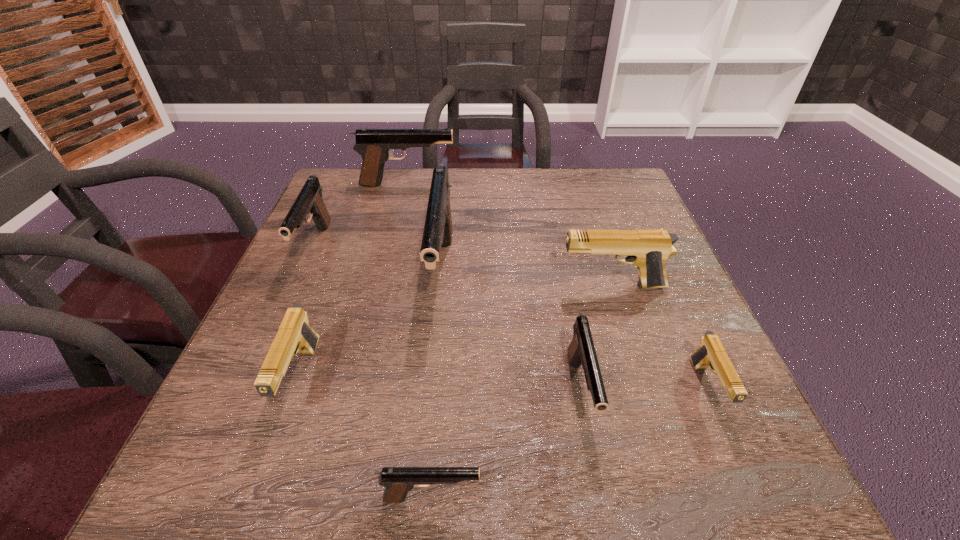
Identify the location of vacant area that lies between the third smallest black pistol and the rightmost black pistol. The height and width of the screenshot is (540, 960). (448, 320).

At what (x,y) coordinates should I click in order to perform the action: click on free space between the nearest object and the farthest tan pistol. Please return your answer as a coordinate pair (x, y). The height and width of the screenshot is (540, 960). Looking at the image, I should click on (522, 392).

At what (x,y) coordinates should I click in order to perform the action: click on free space between the second smallest black pistol and the farthest black pistol. Please return your answer as a coordinate pair (x, y). The width and height of the screenshot is (960, 540). Looking at the image, I should click on (494, 288).

This screenshot has height=540, width=960. What are the coordinates of `vacant area between the leftmost black pistol and the smallest tan pistol` in the screenshot? It's located at (511, 318).

At what (x,y) coordinates should I click in order to perform the action: click on free space between the nearest pistol and the third smallest black pistol. Please return your answer as a coordinate pair (x, y). The image size is (960, 540). Looking at the image, I should click on (373, 372).

Locate an element on the screen. Image resolution: width=960 pixels, height=540 pixels. unoccupied position between the smallest tan pistol and the second smallest black pistol is located at coordinates (644, 391).

This screenshot has height=540, width=960. Find the location of `object that ranks as the fourth closest to the second biggest tan pistol`. object that ranks as the fourth closest to the second biggest tan pistol is located at coordinates (581, 350).

Locate an element on the screen. object that can be found as the seventh closest to the third smallest black pistol is located at coordinates (711, 353).

Locate an element on the screen. Image resolution: width=960 pixels, height=540 pixels. pistol object that ranks as the second closest to the biggest tan pistol is located at coordinates (711, 353).

Identify which pistol is the sixth nearest to the smallest tan pistol. Please provide its 2D coordinates. Your answer should be formatted as a tuple, i.e. [(x, y)], where the tuple contains the x and y coordinates of a point satisfying the conditions above.

[(374, 145)]